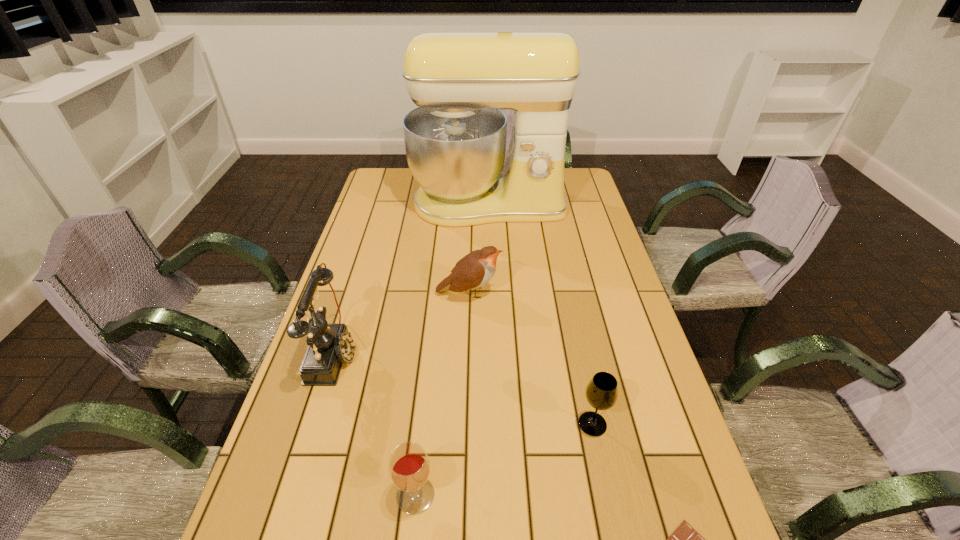
This screenshot has height=540, width=960. In order to click on free space that satisfies the following two spatial constraints: 1. at the face of the third nearest object; 2. on the right side of the bird in this screenshot , I will do `click(466, 424)`.

Find the location of a particular element. Image resolution: width=960 pixels, height=540 pixels. free region that satisfies the following two spatial constraints: 1. on the side of the farthest object with the control knob; 2. on the dial of the third farthest object is located at coordinates (492, 353).

The width and height of the screenshot is (960, 540). Find the location of `vacant position in the image that satisfies the following two spatial constraints: 1. at the face of the farther wineglass; 2. on the left side of the bird`. vacant position in the image that satisfies the following two spatial constraints: 1. at the face of the farther wineglass; 2. on the left side of the bird is located at coordinates 466,424.

Identify the location of vacant position in the image that satisfies the following two spatial constraints: 1. at the face of the fifth nearest object; 2. on the left side of the third nearest object. The height and width of the screenshot is (540, 960). (466, 424).

The width and height of the screenshot is (960, 540). I want to click on vacant region that satisfies the following two spatial constraints: 1. on the dial of the leftmost object; 2. on the back side of the farther wineglass, so click(x=312, y=424).

Image resolution: width=960 pixels, height=540 pixels. I want to click on free space that satisfies the following two spatial constraints: 1. at the face of the fifth nearest object; 2. on the right side of the third nearest object, so click(466, 424).